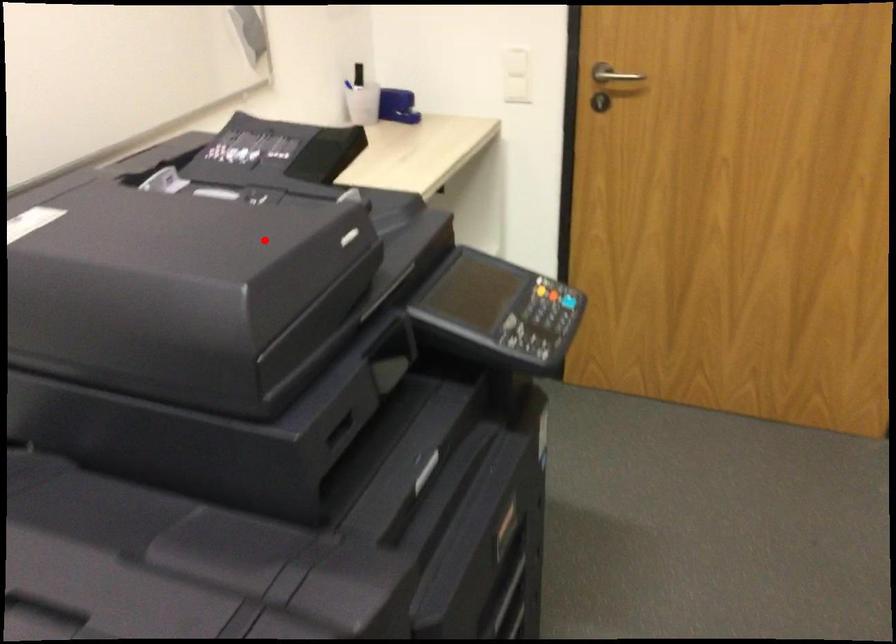
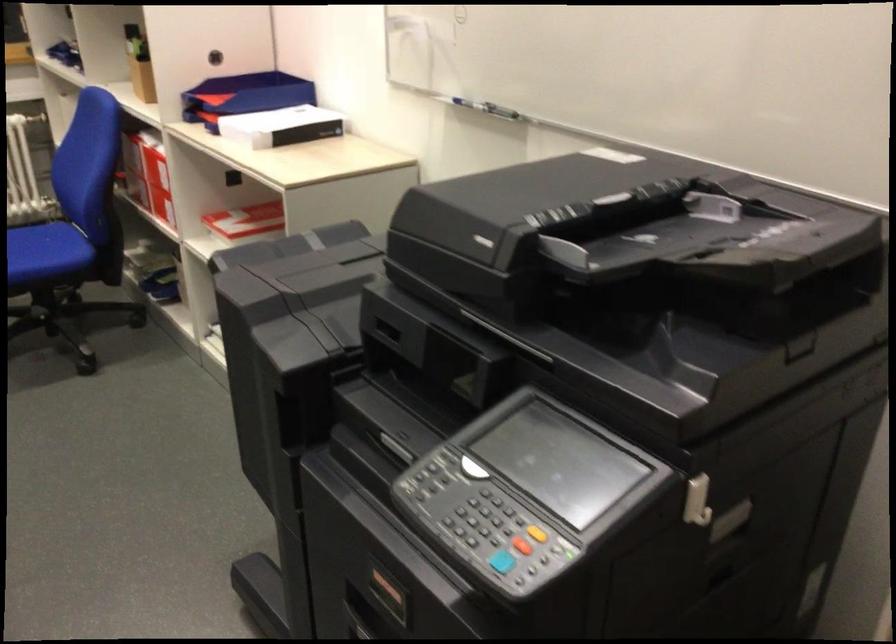
Locate, in the second image, the point that corresponds to the highlighted location in the first image.

(546, 212)